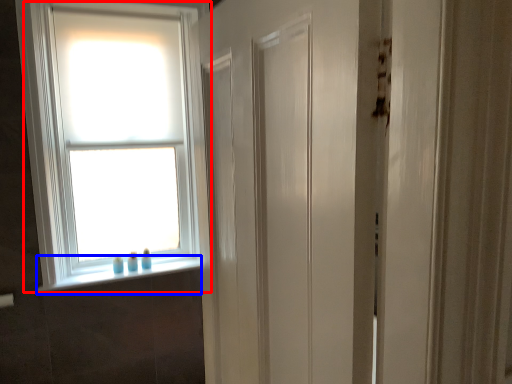
Question: Which object is closer to the camera taking this photo, window (highlighted by a red box) or window sill (highlighted by a blue box)?

Choices:
 (A) window
 (B) window sill

Answer: (A)